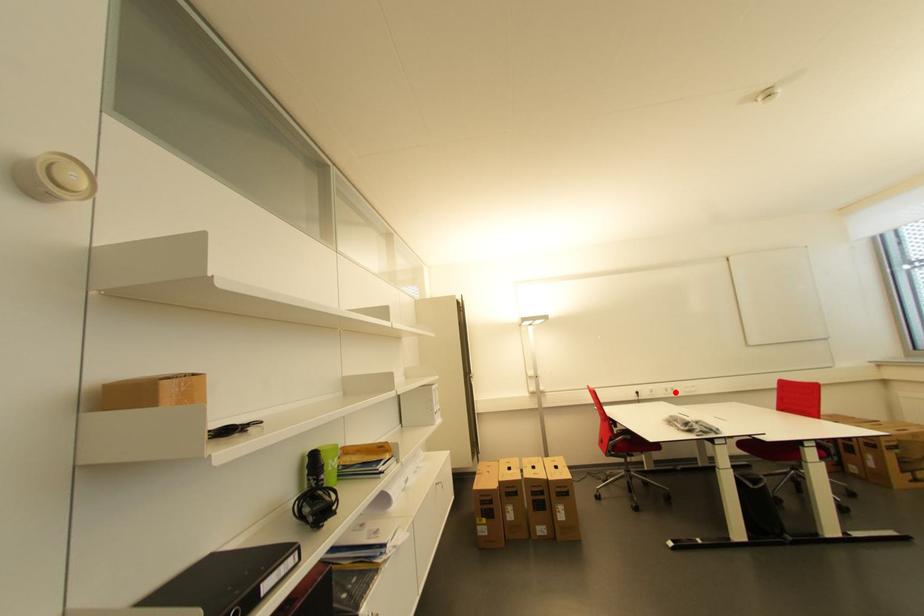
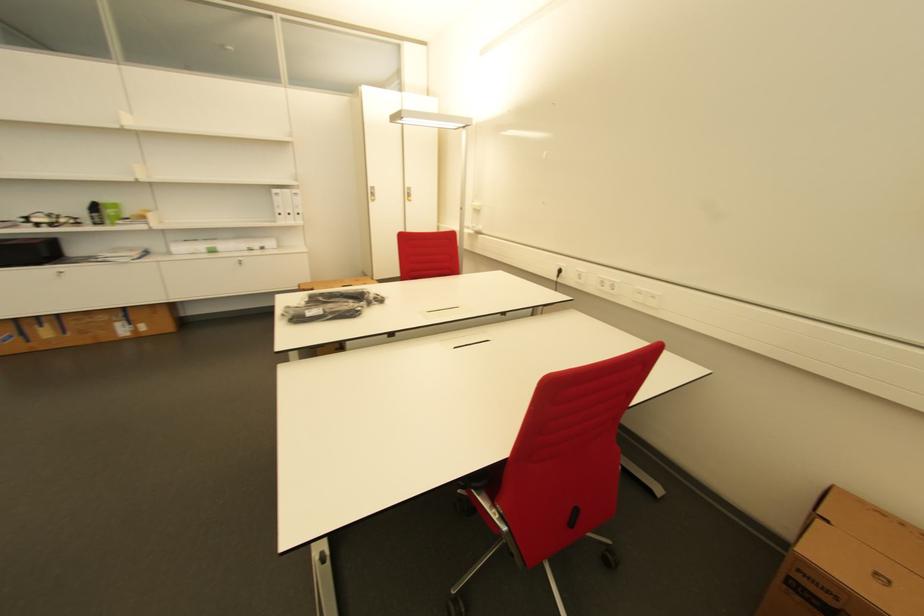
Question: I am providing you with two images of the same scene from different viewpoints. A red point is shown in image1. For the corresponding object point in image2, is it positioned nearer or farther from the camera?

Choices:
 (A) Nearer
 (B) Farther

Answer: (A)